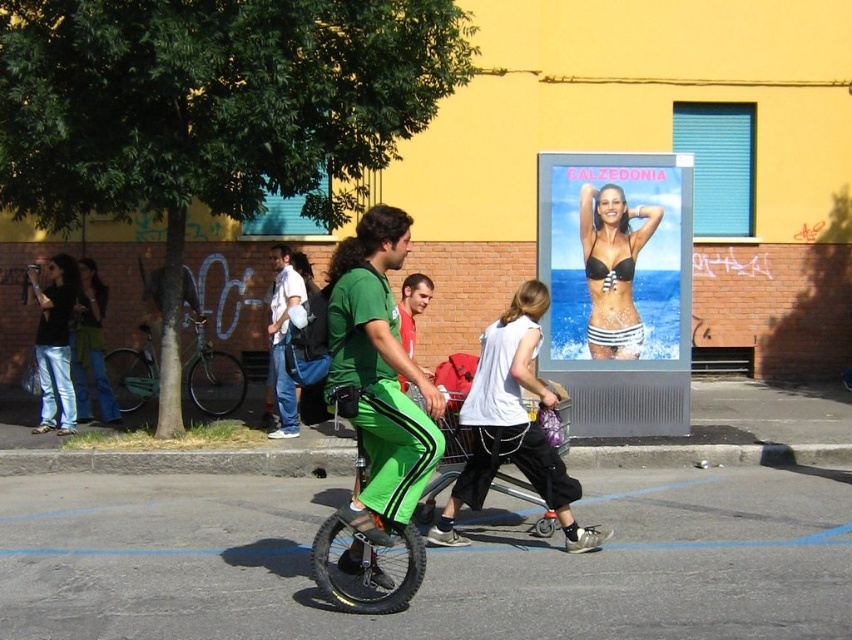
You are a photographer who wants to take a photo of the black bikini at center and the matte black camera at left. Which object will appear larger in your photo?

The black bikini at center will appear larger in the photo because it is closer to the viewer than the matte black camera at left.

You are a photographer standing in the middle of the street. You want to take a photo of the green matte pants at center and the black bikini at center. Which one will appear larger in your photo?

The green matte pants at center will appear larger in the photo because it is closer to the viewer than the black bikini at center.